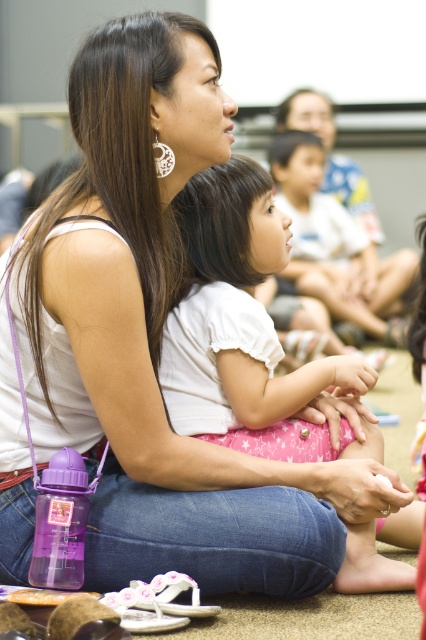
Question: Does white cotton shirt at center lie behind white cotton shirt at upper center?

Choices:
 (A) yes
 (B) no

Answer: (B)

Question: In this image, where is white cotton shirt at center located relative to white cotton shirt at upper center?

Choices:
 (A) above
 (B) below

Answer: (B)

Question: Which object appears farthest from the camera in this image?

Choices:
 (A) white cotton shirt at upper center
 (B) white cotton shirt at center

Answer: (A)

Question: Considering the relative positions of white cotton shirt at center and white cotton shirt at upper center in the image provided, where is white cotton shirt at center located with respect to white cotton shirt at upper center?

Choices:
 (A) above
 (B) below

Answer: (B)

Question: Which point is farther from the camera taking this photo?

Choices:
 (A) (313, 264)
 (B) (247, 365)

Answer: (A)